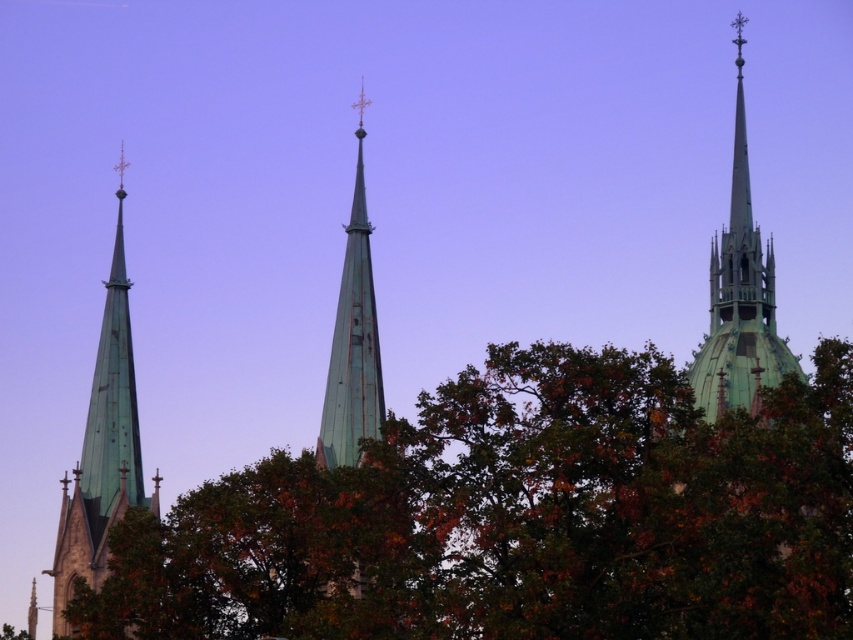
You are a photographer planning to capture the green leafy tree at center and the green copper spire at upper right in a single frame. Based on their widths, which object should you position closer to the edge of the frame to ensure both fit without cropping?

The green leafy tree at center might be wider than green copper spire at upper right, so positioning the wider tree closer to the edge would allow both to fit in the frame without cropping.

You are standing in front of the three church spires. You notice two points marked on the image at coordinates point (x=778, y=618) and point (x=740, y=358). Which point is closer to you?

Point (x=778, y=618) is in front of point (x=740, y=358), so it is closer to you.

You are standing in front of the three church spires. There are two points marked on the image, one at point coordinates point (x=131, y=400) and the other at point coordinates point (x=753, y=305). Which point is closer to you?

Point (x=131, y=400) is closer to you because it is further to the camera than point (x=753, y=305).